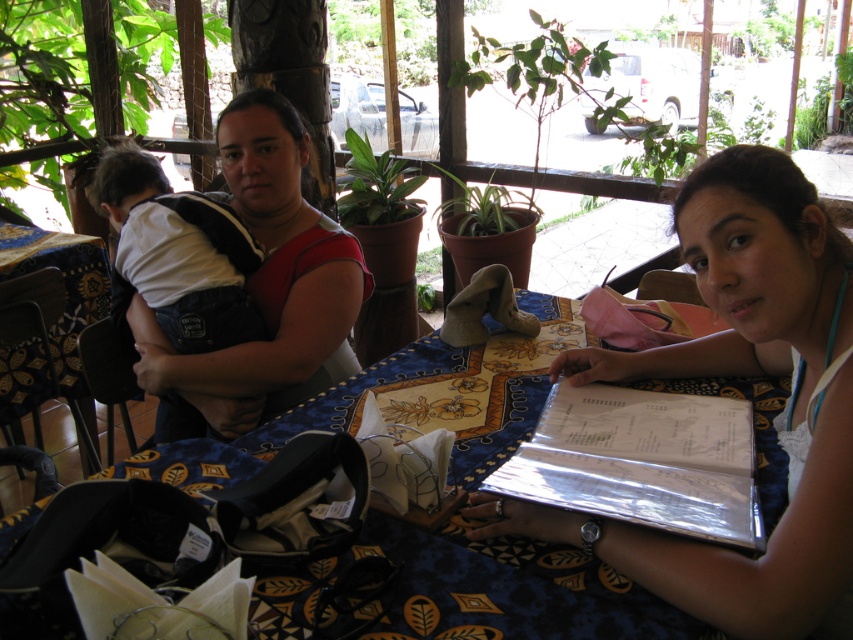
Which is behind, point (729, 355) or point (653, 522)?

Point (729, 355)

In the scene shown: Who is higher up, white plastic menu at center or metallic silver menu at lower right?

white plastic menu at center is above.

Is point (762, 262) less distant than point (624, 449)?

Yes.

The image size is (853, 640). In order to click on white plastic menu at center in this screenshot , I will do `click(743, 376)`.

Is point (828, 520) positioned after point (154, 184)?

That is False.

Is point (589, 376) in front of point (207, 252)?

Yes, it is in front of point (207, 252).

At what (x,y) coordinates should I click in order to perform the action: click on white plastic menu at center. Please return your answer as a coordinate pair (x, y). Looking at the image, I should click on (743, 376).

Is matte red dress at upper left thinner than metallic silver menu at lower right?

No.

Does point (257, 417) lie behind point (523, 468)?

Yes, point (257, 417) is farther from viewer.

This screenshot has width=853, height=640. What do you see at coordinates (267, 282) in the screenshot?
I see `matte red dress at upper left` at bounding box center [267, 282].

The image size is (853, 640). I want to click on matte red dress at upper left, so click(x=267, y=282).